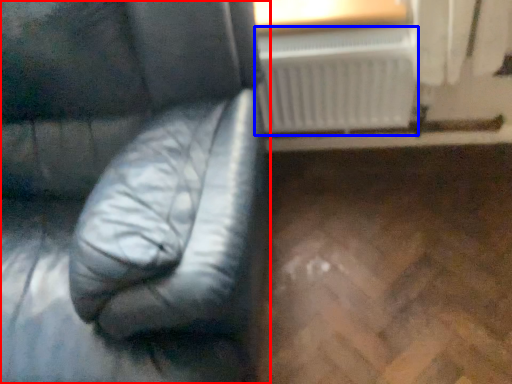
Question: Among these objects, which one is nearest to the camera, furniture (highlighted by a red box) or radiator (highlighted by a blue box)?

Choices:
 (A) furniture
 (B) radiator

Answer: (A)